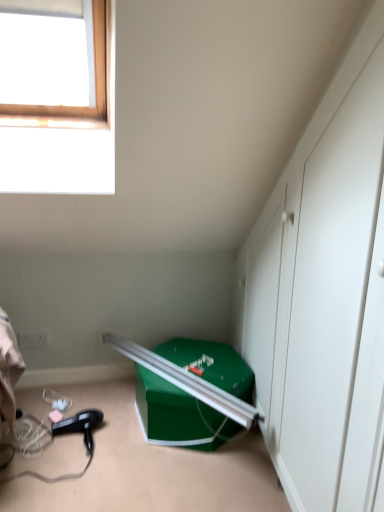
The height and width of the screenshot is (512, 384). In order to click on free location to the left of green cardboard box at lower right in this screenshot , I will do `click(99, 414)`.